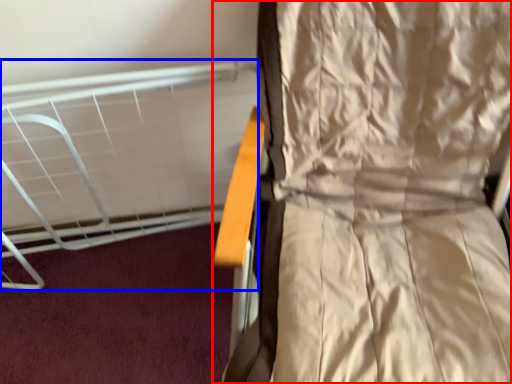
Question: Which object is closer to the camera taking this photo, curtain (highlighted by a red box) or bed (highlighted by a blue box)?

Choices:
 (A) curtain
 (B) bed

Answer: (A)